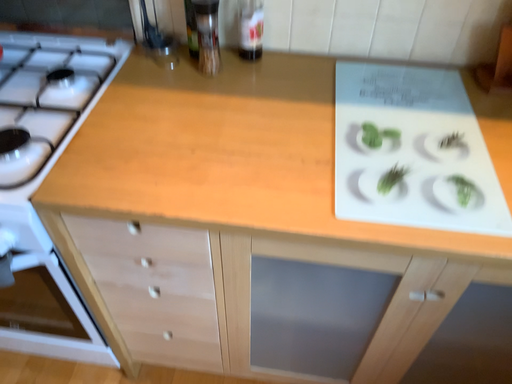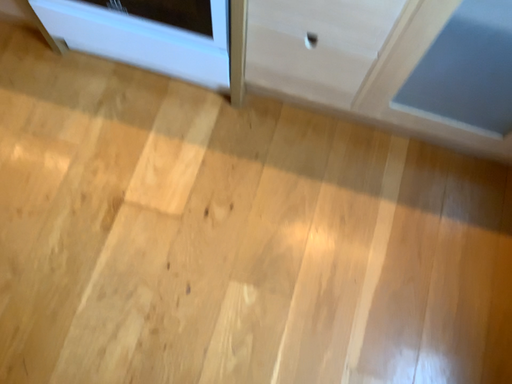
Question: Which way did the camera rotate in the video?

Choices:
 (A) rotated upward
 (B) rotated downward

Answer: (B)